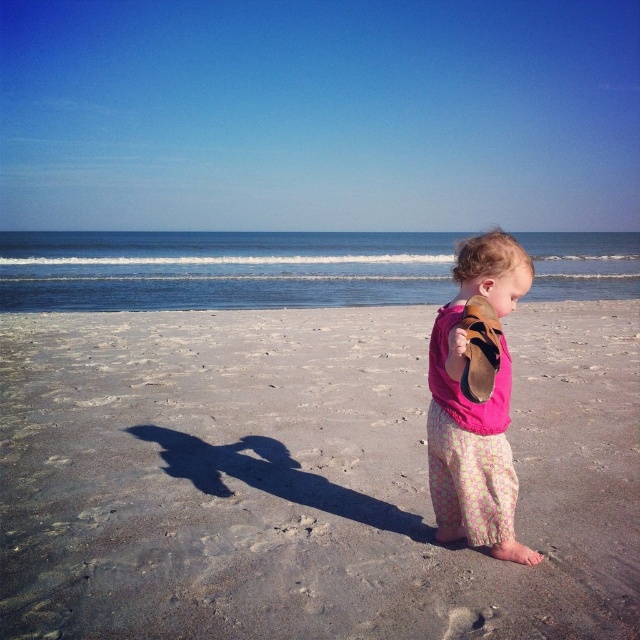
Who is higher up, smooth sand at center or pink fabric shoe at right?

pink fabric shoe at right

Measure the distance between smooth sand at center and camera.

They are 2.91 meters apart.

Find the location of a particular element. The height and width of the screenshot is (640, 640). smooth sand at center is located at coordinates (304, 476).